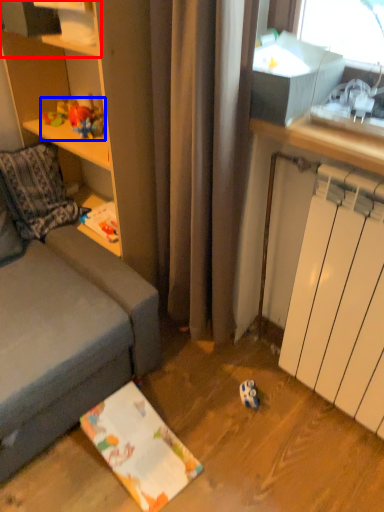
Question: Among these objects, which one is farthest to the camera, shelf (highlighted by a red box) or toy (highlighted by a blue box)?

Choices:
 (A) shelf
 (B) toy

Answer: (B)